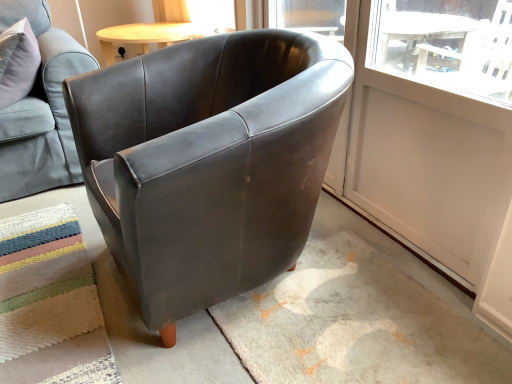
The image size is (512, 384). Find the location of `matte black armchair at center, the 1th chair when ordered from right to left`. matte black armchair at center, the 1th chair when ordered from right to left is located at coordinates (208, 162).

Find the location of a particular element. The image size is (512, 384). white matte screen door at upper right is located at coordinates (425, 160).

From a real-world perspective, which object rests below the other?

white matte screen door at upper right is physically lower.

Can you tell me how much matte leather armchair at upper left, acting as the first chair starting from the left, and white matte screen door at upper right differ in facing direction?

The angular difference between matte leather armchair at upper left, acting as the first chair starting from the left, and white matte screen door at upper right is 5.87 degrees.

Is matte leather armchair at upper left, which ranks as the 2th chair in right-to-left order, to the left or to the right of white matte screen door at upper right in the image?

Based on their positions, matte leather armchair at upper left, which ranks as the 2th chair in right-to-left order, is located to the left of white matte screen door at upper right.

Which object is thinner, matte leather armchair at upper left, acting as the first chair starting from the left, or white matte screen door at upper right?

With smaller width is white matte screen door at upper right.

Who is bigger, multicolored woven mat at lower left or matte leather armchair at upper left, which ranks as the 2th chair in right-to-left order?

Bigger between the two is matte leather armchair at upper left, which ranks as the 2th chair in right-to-left order.

Find the location of a particular element. mat that appears on the right of matte leather armchair at upper left, acting as the first chair starting from the left is located at coordinates (50, 303).

Considering the points (58, 234) and (57, 173), which point is behind, point (58, 234) or point (57, 173)?

Point (57, 173)

Is matte leather armchair at upper left, acting as the first chair starting from the left, completely or partially inside multicolored woven mat at lower left?

Definitely not — matte leather armchair at upper left, acting as the first chair starting from the left, is not inside multicolored woven mat at lower left.

Which object is positioned more to the right, matte leather armchair at upper left, acting as the first chair starting from the left, or matte black armchair at center, arranged as the 2th chair when viewed from the left?

Positioned to the right is matte black armchair at center, arranged as the 2th chair when viewed from the left.

Where is `chair that is in front of the matte leather armchair at upper left, which ranks as the 2th chair in right-to-left order`? This screenshot has height=384, width=512. chair that is in front of the matte leather armchair at upper left, which ranks as the 2th chair in right-to-left order is located at coordinates (208, 162).

Is matte leather armchair at upper left, acting as the first chair starting from the left, next to matte black armchair at center, the 1th chair when ordered from right to left?

matte leather armchair at upper left, acting as the first chair starting from the left, and matte black armchair at center, the 1th chair when ordered from right to left, are clearly separated.

Is matte leather armchair at upper left, which ranks as the 2th chair in right-to-left order, taller or shorter than matte black armchair at center, arranged as the 2th chair when viewed from the left?

Clearly, matte leather armchair at upper left, which ranks as the 2th chair in right-to-left order, is shorter compared to matte black armchair at center, arranged as the 2th chair when viewed from the left.

Considering the sizes of objects white matte screen door at upper right and matte black armchair at center, arranged as the 2th chair when viewed from the left, in the image provided, who is shorter, white matte screen door at upper right or matte black armchair at center, arranged as the 2th chair when viewed from the left,?

matte black armchair at center, arranged as the 2th chair when viewed from the left, is shorter.

From the image's perspective, between white matte screen door at upper right and matte black armchair at center, arranged as the 2th chair when viewed from the left, who is located below?

From the image's view, matte black armchair at center, arranged as the 2th chair when viewed from the left, is below.

Considering the sizes of white matte screen door at upper right and matte black armchair at center, the 1th chair when ordered from right to left, in the image, is white matte screen door at upper right bigger or smaller than matte black armchair at center, the 1th chair when ordered from right to left,?

In the image, white matte screen door at upper right appears to be smaller than matte black armchair at center, the 1th chair when ordered from right to left.

This screenshot has width=512, height=384. I want to click on chair in front of the multicolored woven mat at lower left, so click(x=208, y=162).

Is point (54, 331) more distant than point (167, 50)?

No, (54, 331) is in front of (167, 50).

Is multicolored woven mat at lower left next to matte black armchair at center, the 1th chair when ordered from right to left, and touching it?

There is a gap between multicolored woven mat at lower left and matte black armchair at center, the 1th chair when ordered from right to left.

Identify the location of screen door that is behind the matte black armchair at center, the 1th chair when ordered from right to left. This screenshot has height=384, width=512. (425, 160).

Visually, is matte black armchair at center, the 1th chair when ordered from right to left, positioned to the left or to the right of white matte screen door at upper right?

Based on their positions, matte black armchair at center, the 1th chair when ordered from right to left, is located to the left of white matte screen door at upper right.

Between matte black armchair at center, arranged as the 2th chair when viewed from the left, and white matte screen door at upper right, which one has larger width?

matte black armchair at center, arranged as the 2th chair when viewed from the left.

Does point (253, 145) appear closer or farther from the camera than point (496, 218)?

Clearly, point (253, 145) is closer to the camera than point (496, 218).

Based on the photo, is white matte screen door at upper right facing towards matte leather armchair at upper left, which ranks as the 2th chair in right-to-left order?

No.

Considering the points (469, 134) and (52, 157), which point is in front, point (469, 134) or point (52, 157)?

The point (469, 134) is in front.

In the image, is white matte screen door at upper right on the left side or the right side of matte leather armchair at upper left, which ranks as the 2th chair in right-to-left order?

In the image, white matte screen door at upper right appears on the right side of matte leather armchair at upper left, which ranks as the 2th chair in right-to-left order.

Where is `screen door lying in front of the matte leather armchair at upper left, acting as the first chair starting from the left`? screen door lying in front of the matte leather armchair at upper left, acting as the first chair starting from the left is located at coordinates (425, 160).

You are a GUI agent. You are given a task and a screenshot of the screen. Output one action in this format:
    pyautogui.click(x=<x>, y=<y>)
    Task: Click on the mat located below the matte leather armchair at upper left, which ranks as the 2th chair in right-to-left order (from the image's perspective)
    The height and width of the screenshot is (384, 512).
    Given the screenshot: What is the action you would take?
    pyautogui.click(x=50, y=303)

From the image, which object appears to be nearer to white matte screen door at upper right, matte black armchair at center, arranged as the 2th chair when viewed from the left, or multicolored woven mat at lower left?

matte black armchair at center, arranged as the 2th chair when viewed from the left, is positioned closer to the anchor white matte screen door at upper right.

When comparing their distances from multicolored woven mat at lower left, does matte leather armchair at upper left, which ranks as the 2th chair in right-to-left order, or matte black armchair at center, arranged as the 2th chair when viewed from the left, seem further?

Based on the image, matte leather armchair at upper left, which ranks as the 2th chair in right-to-left order, appears to be further to multicolored woven mat at lower left.

Looking at the image, which one is located closer to matte leather armchair at upper left, which ranks as the 2th chair in right-to-left order, multicolored woven mat at lower left or matte black armchair at center, arranged as the 2th chair when viewed from the left?

multicolored woven mat at lower left is closer to matte leather armchair at upper left, which ranks as the 2th chair in right-to-left order.

Based on the photo, based on their spatial positions, is matte black armchair at center, arranged as the 2th chair when viewed from the left, or matte leather armchair at upper left, which ranks as the 2th chair in right-to-left order, further from white matte screen door at upper right?

matte leather armchair at upper left, which ranks as the 2th chair in right-to-left order, lies further to white matte screen door at upper right than the other object.

When comparing their distances from multicolored woven mat at lower left, does matte leather armchair at upper left, which ranks as the 2th chair in right-to-left order, or white matte screen door at upper right seem further?

The object further to multicolored woven mat at lower left is white matte screen door at upper right.

Estimate the real-world distances between objects in this image. Which object is further from matte black armchair at center, the 1th chair when ordered from right to left, matte leather armchair at upper left, acting as the first chair starting from the left, or white matte screen door at upper right?

The object further to matte black armchair at center, the 1th chair when ordered from right to left, is matte leather armchair at upper left, acting as the first chair starting from the left.

Estimate the real-world distances between objects in this image. Which object is closer to matte black armchair at center, the 1th chair when ordered from right to left, matte leather armchair at upper left, which ranks as the 2th chair in right-to-left order, or multicolored woven mat at lower left?

multicolored woven mat at lower left.

Looking at the image, which one is located closer to white matte screen door at upper right, multicolored woven mat at lower left or matte leather armchair at upper left, acting as the first chair starting from the left?

multicolored woven mat at lower left is closer to white matte screen door at upper right.

Identify the location of chair between multicolored woven mat at lower left and white matte screen door at upper right from left to right. (208, 162).

Where is `mat located between matte leather armchair at upper left, acting as the first chair starting from the left, and matte black armchair at center, arranged as the 2th chair when viewed from the left, in the left-right direction`? This screenshot has width=512, height=384. mat located between matte leather armchair at upper left, acting as the first chair starting from the left, and matte black armchair at center, arranged as the 2th chair when viewed from the left, in the left-right direction is located at coordinates (50, 303).

Where is `mat situated between matte leather armchair at upper left, which ranks as the 2th chair in right-to-left order, and white matte screen door at upper right from left to right`? The width and height of the screenshot is (512, 384). mat situated between matte leather armchair at upper left, which ranks as the 2th chair in right-to-left order, and white matte screen door at upper right from left to right is located at coordinates pos(50,303).

Locate an element on the screen. chair between matte leather armchair at upper left, acting as the first chair starting from the left, and white matte screen door at upper right, in the horizontal direction is located at coordinates (208, 162).